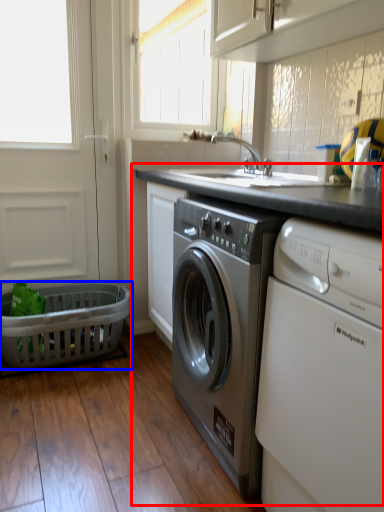
Question: Which of the following is the closest to the observer, counter (highlighted by a red box) or basket (highlighted by a blue box)?

Choices:
 (A) counter
 (B) basket

Answer: (A)